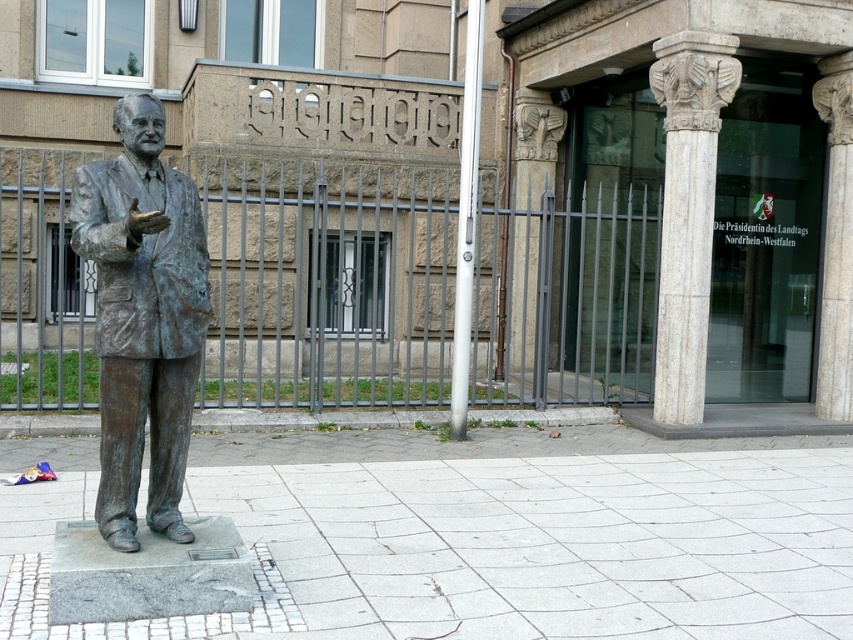
Question: Observing the image, what is the correct spatial positioning of bronze statue at center in reference to white marble column at center?

Choices:
 (A) above
 (B) below

Answer: (B)

Question: Does bronze statue at center have a larger size compared to white marble column at center?

Choices:
 (A) yes
 (B) no

Answer: (B)

Question: Can you confirm if bronze statue at center is smaller than white marble column at center?

Choices:
 (A) yes
 (B) no

Answer: (A)

Question: Which object appears farthest from the camera in this image?

Choices:
 (A) bronze statue at center
 (B) white marble column at center

Answer: (B)